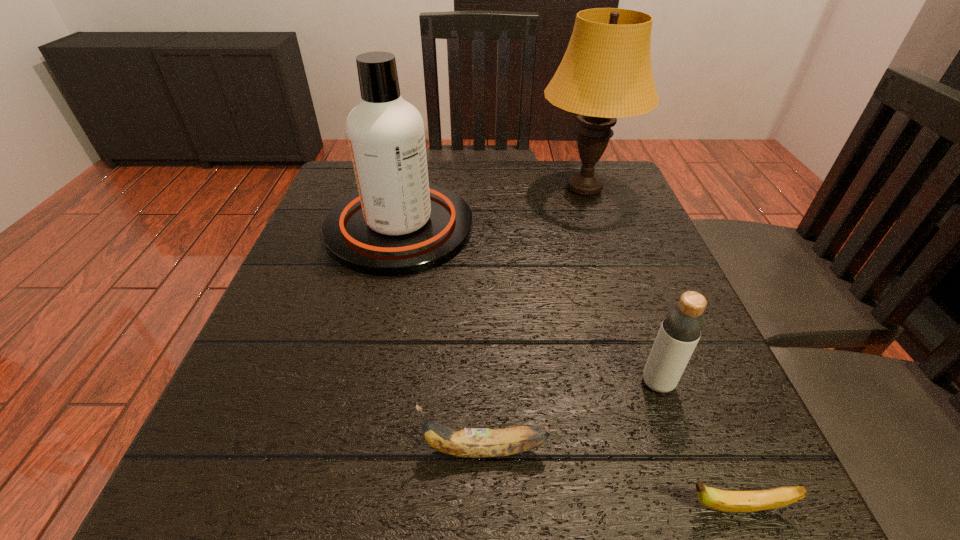
Where is `lampshade`? lampshade is located at coordinates (606, 73).

This screenshot has width=960, height=540. I want to click on cleansing agent, so click(398, 224).

Find the location of a particular element. Image resolution: width=960 pixels, height=540 pixels. the third nearest object is located at coordinates (683, 324).

You are a GUI agent. You are given a task and a screenshot of the screen. Output one action in this format:
    pyautogui.click(x=<x>, y=<y>)
    Task: Click on the bottle
    
    Given the screenshot: What is the action you would take?
    pyautogui.click(x=683, y=324)

The width and height of the screenshot is (960, 540). Find the location of `the taller banana`. the taller banana is located at coordinates (468, 442).

The width and height of the screenshot is (960, 540). Identify the location of the second nearest object. (468, 442).

Locate an element on the screen. the nearer banana is located at coordinates (720, 500).

This screenshot has height=540, width=960. What are the coordinates of `the shorter banana` in the screenshot? It's located at [720, 500].

Locate an element on the screen. The image size is (960, 540). vacant space located on the front of the lampshade is located at coordinates (620, 293).

Find the location of a particular element. The height and width of the screenshot is (540, 960). free location located on the back of the cleansing agent is located at coordinates (416, 160).